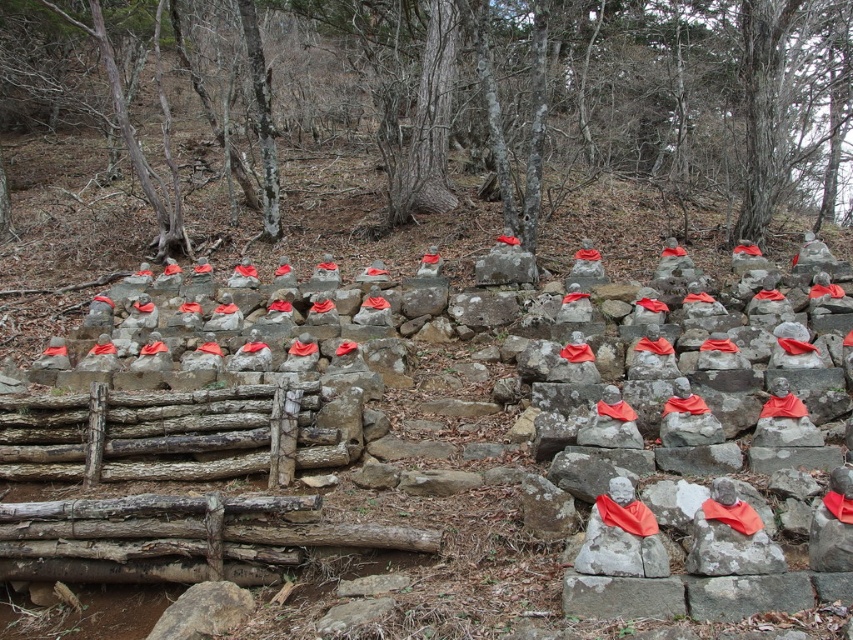
Question: Is smooth gray statue at center closer to camera compared to weathered wood at center?

Choices:
 (A) yes
 (B) no

Answer: (B)

Question: Among these points, which one is nearest to the camera?

Choices:
 (A) (242, 460)
 (B) (728, 540)
 (C) (51, 440)

Answer: (B)

Question: Estimate the real-world distances between objects in this image. Which object is farther from the smooth gray rock at center?

Choices:
 (A) weathered wood at center
 (B) smooth gray statue at center

Answer: (B)

Question: Which of the following is the closest to the observer?

Choices:
 (A) (192, 451)
 (B) (753, 532)

Answer: (B)

Question: Is smooth gray statue at center wider than weathered wood at center?

Choices:
 (A) no
 (B) yes

Answer: (B)

Question: Is weathered wood at center thinner than smooth gray rock at center?

Choices:
 (A) yes
 (B) no

Answer: (B)